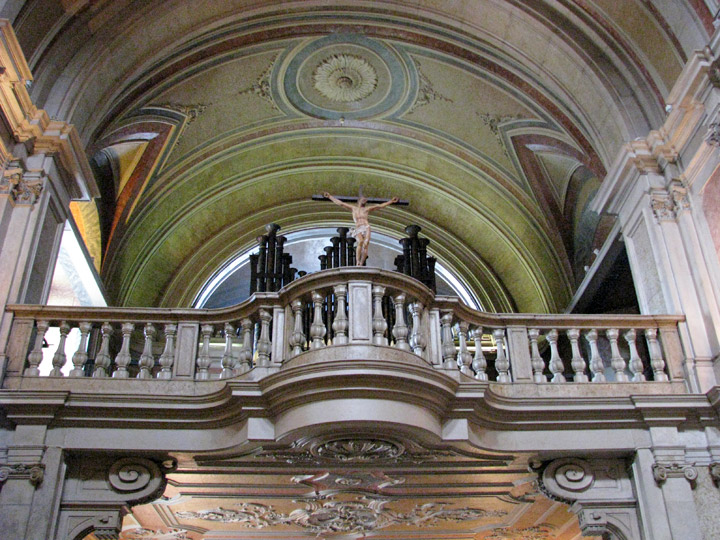
Find the location of `crucifix`. crucifix is located at coordinates (364, 206).